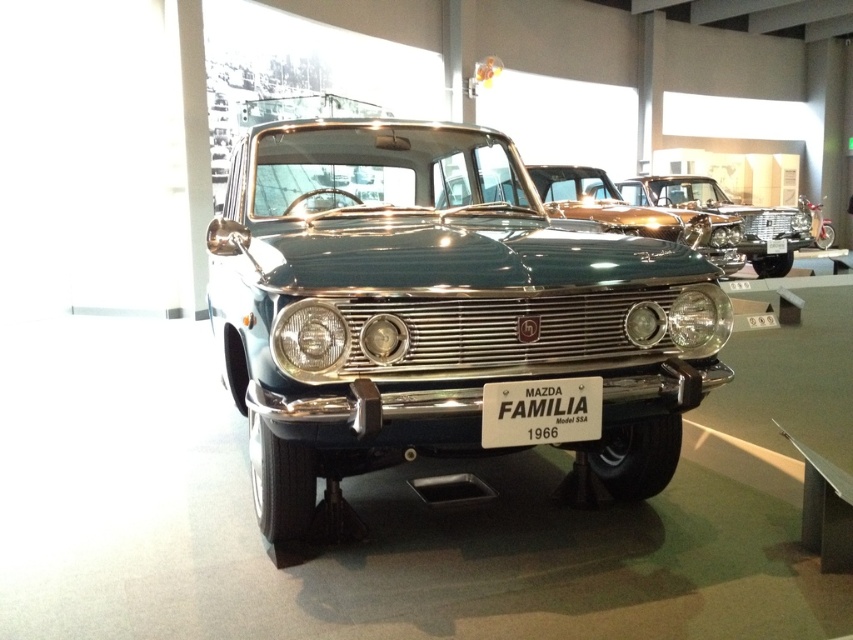
Is shiny metallic car at center positioned in front of clear glass headlight at center?

That is False.

Does shiny metallic car at center appear on the left side of clear glass headlight at center?

Incorrect, shiny metallic car at center is not on the left side of clear glass headlight at center.

Is point (722, 257) behind point (334, 346)?

That is True.

Locate an element on the screen. This screenshot has height=640, width=853. shiny metallic car at center is located at coordinates click(634, 212).

Does shiny metallic car at center have a smaller size compared to matte chrome headlight at center?

No.

Is point (585, 176) positioned in front of point (714, 316)?

No, it is behind (714, 316).

Between point (614, 230) and point (705, 333), which one is positioned behind?

The point (614, 230) is behind.

This screenshot has height=640, width=853. I want to click on shiny metallic car at center, so click(634, 212).

Is white plastic license plate at center above matte chrome headlight at center?

Incorrect, white plastic license plate at center is not positioned above matte chrome headlight at center.

Is point (595, 401) positioned behind point (689, 292)?

That is False.

The height and width of the screenshot is (640, 853). Identify the location of white plastic license plate at center. (540, 412).

This screenshot has height=640, width=853. Find the location of `white plastic license plate at center`. white plastic license plate at center is located at coordinates (540, 412).